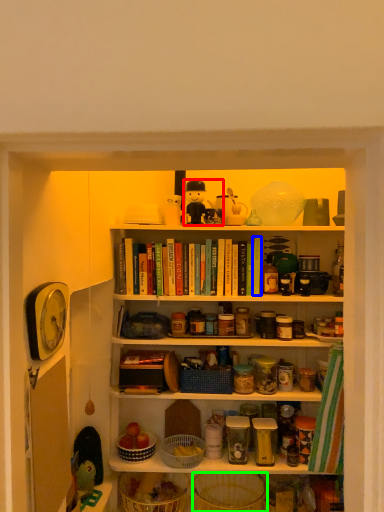
Question: Which object is positioned farthest from toy (highlighted by a red box)? Select from book (highlighted by a blue box) and basket (highlighted by a green box).

Choices:
 (A) book
 (B) basket

Answer: (B)